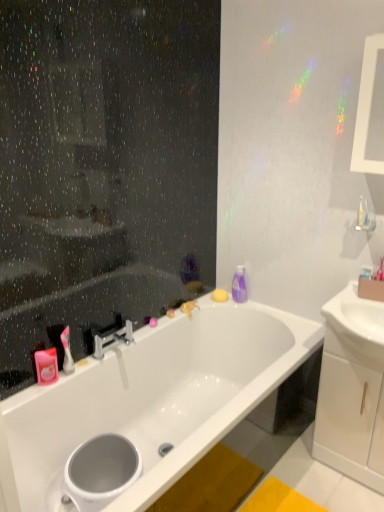
Question: Is white glossy sink at right not close to white glossy toilet bowl at lower left?

Choices:
 (A) no
 (B) yes

Answer: (B)

Question: From the image's perspective, is white glossy sink at right located above white glossy toilet bowl at lower left?

Choices:
 (A) no
 (B) yes

Answer: (B)

Question: From a real-world perspective, is white glossy sink at right located beneath white glossy toilet bowl at lower left?

Choices:
 (A) yes
 (B) no

Answer: (B)

Question: Is white glossy sink at right positioned beyond the bounds of white glossy toilet bowl at lower left?

Choices:
 (A) yes
 (B) no

Answer: (A)

Question: Considering the relative sizes of white glossy sink at right and white glossy toilet bowl at lower left in the image provided, is white glossy sink at right shorter than white glossy toilet bowl at lower left?

Choices:
 (A) no
 (B) yes

Answer: (B)

Question: Can you confirm if white glossy sink at right is wider than white glossy toilet bowl at lower left?

Choices:
 (A) yes
 (B) no

Answer: (A)

Question: Is pink matte soap at upper left, placed as the 2th toiletry when sorted from top to bottom, turned away from purple glossy bottle at upper right, the 1th toiletry from the back?

Choices:
 (A) yes
 (B) no

Answer: (B)

Question: Is pink matte soap at upper left, which is the 2th toiletry in back-to-front order, not inside purple glossy bottle at upper right, which is the 1th toiletry in right-to-left order?

Choices:
 (A) yes
 (B) no

Answer: (A)

Question: From the image's perspective, is pink matte soap at upper left, placed as the 2th toiletry when sorted from top to bottom, over purple glossy bottle at upper right, which is the 1th toiletry in right-to-left order?

Choices:
 (A) yes
 (B) no

Answer: (B)

Question: Considering the relative sizes of pink matte soap at upper left, which is the 2th toiletry in back-to-front order, and purple glossy bottle at upper right, which appears as the second toiletry when ordered from the bottom, in the image provided, is pink matte soap at upper left, which is the 2th toiletry in back-to-front order, bigger than purple glossy bottle at upper right, which appears as the second toiletry when ordered from the bottom,?

Choices:
 (A) no
 (B) yes

Answer: (A)

Question: Considering the relative sizes of pink matte soap at upper left, positioned as the first toiletry in left-to-right order, and purple glossy bottle at upper right, the 2th toiletry from the front, in the image provided, is pink matte soap at upper left, positioned as the first toiletry in left-to-right order, wider than purple glossy bottle at upper right, the 2th toiletry from the front,?

Choices:
 (A) no
 (B) yes

Answer: (A)

Question: Can you see pink matte soap at upper left, which is the 2th toiletry in back-to-front order, touching purple glossy bottle at upper right, the 1th toiletry from the back?

Choices:
 (A) yes
 (B) no

Answer: (B)

Question: From the image's perspective, would you say white glossy bathtub at center is shown under white glossy toilet bowl at lower left?

Choices:
 (A) no
 (B) yes

Answer: (A)